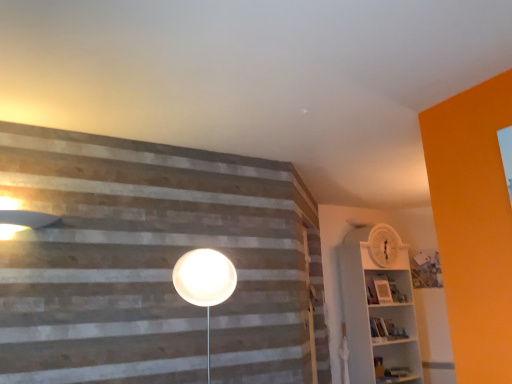
Question: Should I look upward or downward to see white plastic shelf at right?

Choices:
 (A) up
 (B) down

Answer: (B)

Question: Is matte white lampshade at upper left at the back of white matte barn door at center?

Choices:
 (A) yes
 (B) no

Answer: (B)

Question: Is white matte barn door at center to the right of matte white lampshade at upper left from the viewer's perspective?

Choices:
 (A) no
 (B) yes

Answer: (B)

Question: Considering the relative sizes of white matte barn door at center and matte white lampshade at upper left in the image provided, is white matte barn door at center wider than matte white lampshade at upper left?

Choices:
 (A) yes
 (B) no

Answer: (B)

Question: From a real-world perspective, is white matte barn door at center physically below matte white lampshade at upper left?

Choices:
 (A) yes
 (B) no

Answer: (A)

Question: Can you confirm if white matte barn door at center is bigger than matte white lampshade at upper left?

Choices:
 (A) no
 (B) yes

Answer: (B)

Question: Is white matte barn door at center touching matte white lampshade at upper left?

Choices:
 (A) no
 (B) yes

Answer: (A)

Question: From the image's perspective, is white matte barn door at center under white plastic shelf at right?

Choices:
 (A) yes
 (B) no

Answer: (B)

Question: Is white matte barn door at center looking in the opposite direction of white plastic shelf at right?

Choices:
 (A) yes
 (B) no

Answer: (B)

Question: Does white matte barn door at center appear on the left side of white plastic shelf at right?

Choices:
 (A) no
 (B) yes

Answer: (B)

Question: Does white matte barn door at center have a smaller size compared to white plastic shelf at right?

Choices:
 (A) yes
 (B) no

Answer: (A)

Question: Would you say white plastic shelf at right is part of white matte barn door at center's contents?

Choices:
 (A) yes
 (B) no

Answer: (B)

Question: Could you tell me if white matte barn door at center is turned towards white plastic shelf at right?

Choices:
 (A) no
 (B) yes

Answer: (A)

Question: Can you confirm if white plastic shelf at right is wider than white matte barn door at center?

Choices:
 (A) yes
 (B) no

Answer: (A)